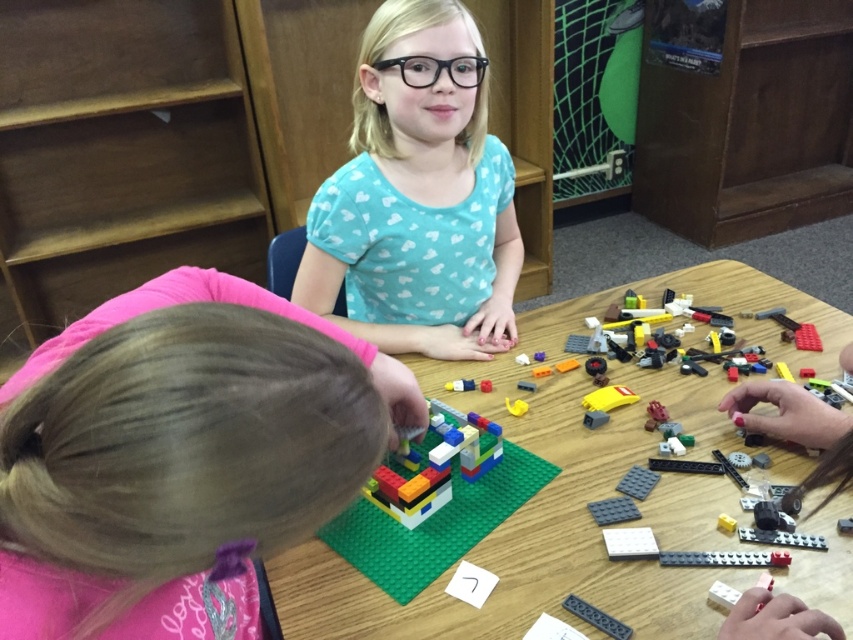
Question: Which object is farther from the camera taking this photo?

Choices:
 (A) translucent plastic lego at center
 (B) smooth pink shirt at lower left
 (C) yellow plastic toy at center

Answer: (C)

Question: Considering the relative positions of smooth pink shirt at lower left and blue matte shirt at upper center in the image provided, where is smooth pink shirt at lower left located with respect to blue matte shirt at upper center?

Choices:
 (A) left
 (B) right

Answer: (A)

Question: Among these objects, which one is nearest to the camera?

Choices:
 (A) translucent plastic lego at center
 (B) black plastic plate at lower center

Answer: (B)

Question: Is translucent plastic lego at center above smooth plastic lego piece at center?

Choices:
 (A) yes
 (B) no

Answer: (B)

Question: Can you confirm if multicolored plastic lego pieces at center is positioned below yellow matte plastic at center?

Choices:
 (A) no
 (B) yes

Answer: (B)

Question: Which point is farther to the camera?

Choices:
 (A) yellow plastic toy at center
 (B) blue matte shirt at upper center
 (C) multicolored plastic lego pieces at center

Answer: (B)